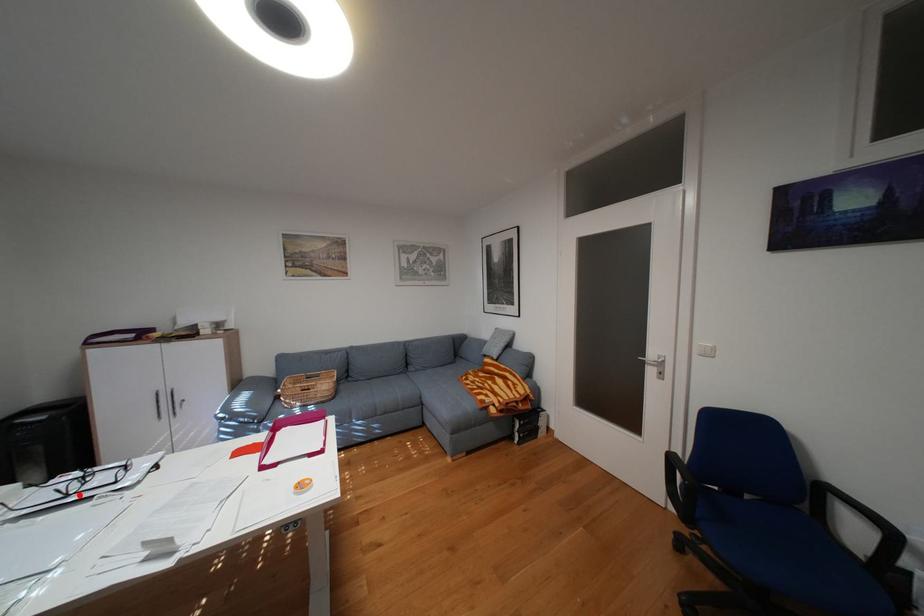
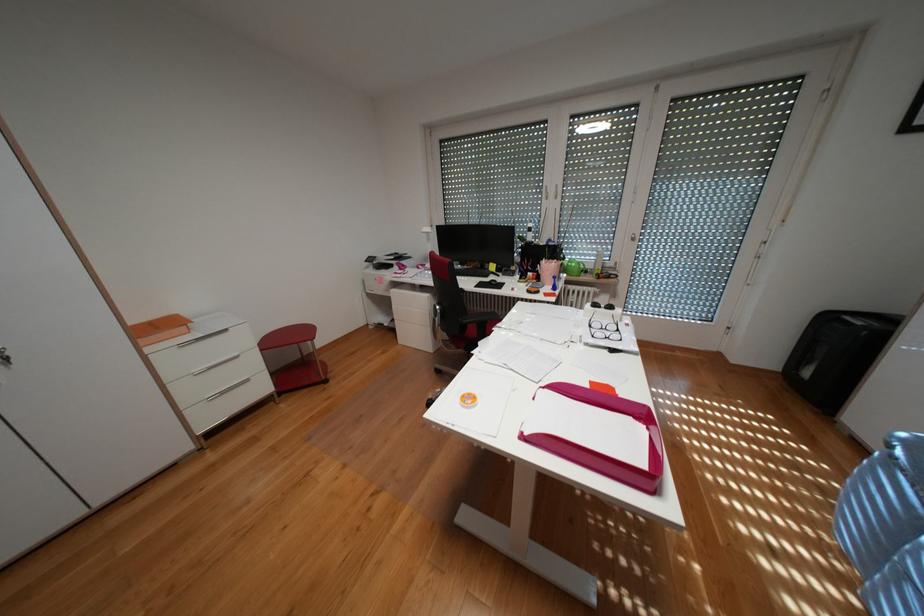
The point at the highlighted location is marked in the first image. Where is the corresponding point in the second image?

(602, 325)